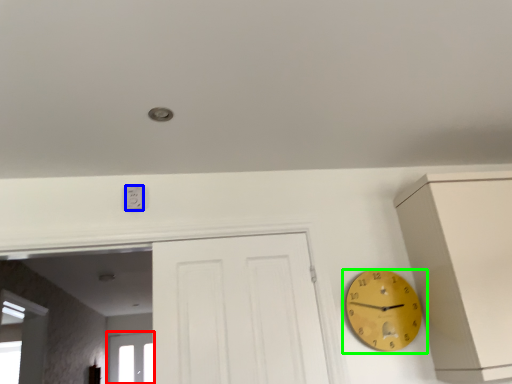
Question: Which object is positioned closest to window (highlighted by a red box)? Select from electric outlet (highlighted by a blue box) and wall clock (highlighted by a green box).

Choices:
 (A) electric outlet
 (B) wall clock

Answer: (A)